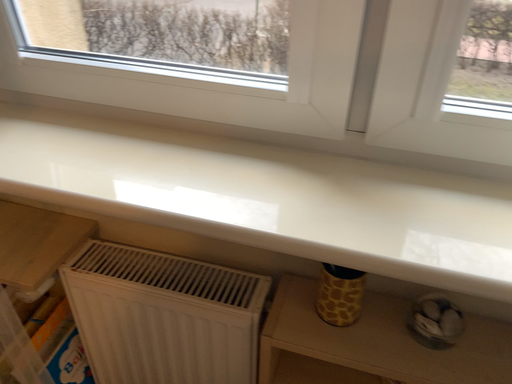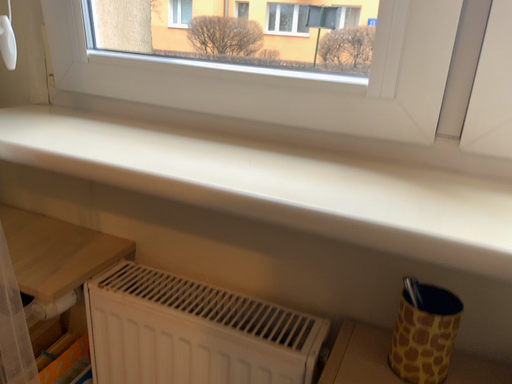
Question: Which way did the camera rotate in the video?

Choices:
 (A) rotated downward
 (B) rotated upward

Answer: (B)